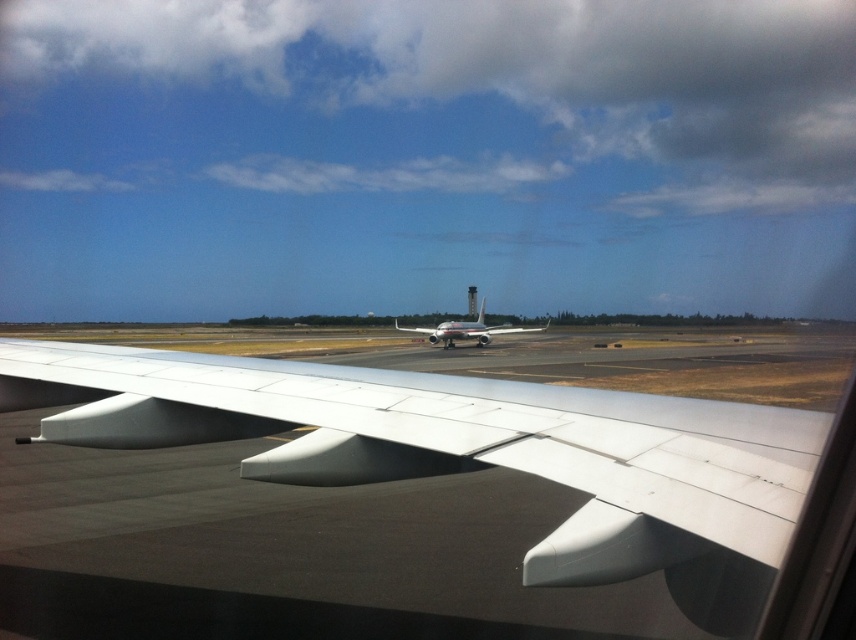
Is point (141, 396) closer to viewer compared to point (461, 333)?

Yes, point (141, 396) is in front of point (461, 333).

Does white matte wing at center lie in front of silver metallic airplane at center?

Yes, it is in front of silver metallic airplane at center.

I want to click on white matte wing at center, so click(456, 444).